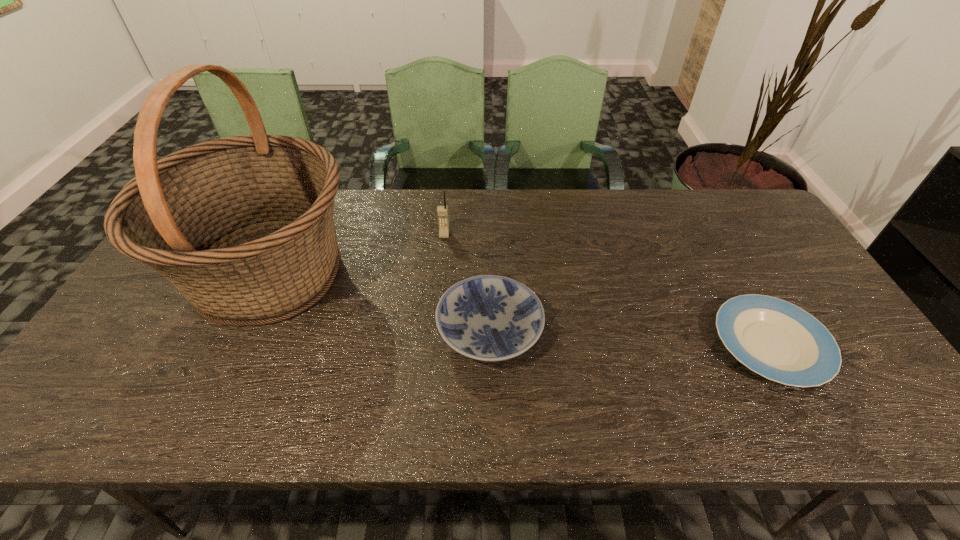
This screenshot has height=540, width=960. In the image, there is a desktop. Identify the location of vacant space at the right edge. (808, 291).

Where is `unoccupied area between the basket and the third tallest object`? unoccupied area between the basket and the third tallest object is located at coordinates (379, 302).

Locate an element on the screen. This screenshot has height=540, width=960. vacant space that's between the taller plate and the tallest object is located at coordinates (379, 302).

I want to click on free space between the second shortest object and the leftmost object, so click(379, 302).

I want to click on free space between the taller plate and the right plate, so click(x=630, y=338).

Identify the location of empty location between the cellular telephone and the basket. The height and width of the screenshot is (540, 960). (357, 254).

Where is `vacant space that is in between the left plate and the tallest object`? The image size is (960, 540). vacant space that is in between the left plate and the tallest object is located at coordinates (379, 302).

I want to click on vacant point located between the third shortest object and the basket, so click(357, 254).

Identify which object is located as the second nearest to the basket. Please provide its 2D coordinates. Your answer should be formatted as a tuple, i.e. [(x, y)], where the tuple contains the x and y coordinates of a point satisfying the conditions above.

[(490, 318)]

At what (x,y) coordinates should I click in order to perform the action: click on object identified as the second closest to the right plate. Please return your answer as a coordinate pair (x, y). The image size is (960, 540). Looking at the image, I should click on (442, 211).